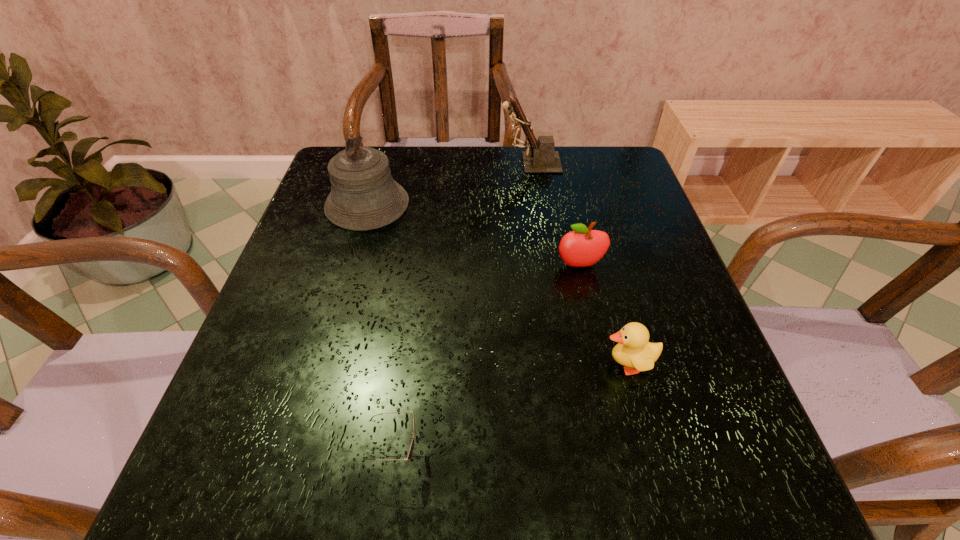
In order to click on free region located on the right of the bell in this screenshot , I will do `click(523, 204)`.

Find the location of a particular element. The width and height of the screenshot is (960, 540). free region located 0.250m on the front of the apple is located at coordinates (605, 378).

Locate an element on the screen. vacant space situated on the front-facing side of the fourth farthest object is located at coordinates (438, 364).

At what (x,y) coordinates should I click in order to perform the action: click on blank space located on the front-facing side of the fourth farthest object. Please return your answer as a coordinate pair (x, y). Image resolution: width=960 pixels, height=540 pixels. Looking at the image, I should click on (426, 364).

Where is `vacant space positioned 0.360m on the front-facing side of the fourth farthest object`? vacant space positioned 0.360m on the front-facing side of the fourth farthest object is located at coordinates (392, 364).

The width and height of the screenshot is (960, 540). I want to click on vacant area situated in front of the lenses of the sunglasses, so click(x=664, y=454).

Find the location of a particular element. This screenshot has height=540, width=960. figurine located at the far edge is located at coordinates (542, 158).

Locate an element on the screen. Image resolution: width=960 pixels, height=540 pixels. bell that is at the far edge is located at coordinates (364, 196).

Locate an element on the screen. object located at the near edge is located at coordinates (410, 452).

Locate an element on the screen. The height and width of the screenshot is (540, 960). object that is at the left edge is located at coordinates (364, 196).